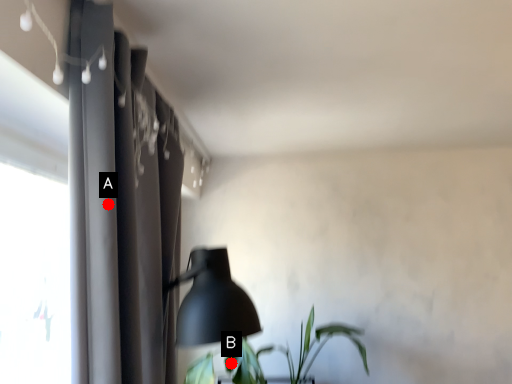
Question: Two points are circled on the image, labeled by A and B beside each circle. Which of the following is the farthest from the observer?

Choices:
 (A) A is further
 (B) B is further

Answer: (B)